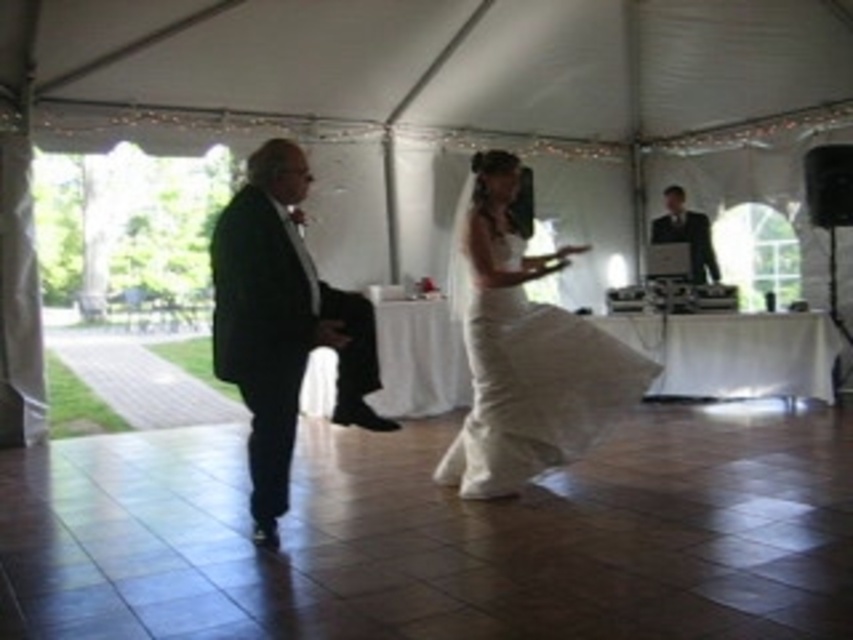
Where is `matte black suit at left`? matte black suit at left is located at coordinates (527, 356).

Can you confirm if matte black suit at left is thinner than matte black suit at upper right?

No.

Is point (288, 300) in front of point (694, 218)?

That is True.

Image resolution: width=853 pixels, height=640 pixels. Identify the location of matte black suit at left. (527, 356).

Is point (146, 74) farther from viewer compared to point (256, 285)?

Yes, point (146, 74) is farther from viewer.

Looking at this image, who is higher up, white fabric canopy at upper center or black satin suit at left?

white fabric canopy at upper center

Which is behind, point (637, 129) or point (227, 276)?

Point (637, 129)

Find the location of a particular element. The width and height of the screenshot is (853, 640). white fabric canopy at upper center is located at coordinates (440, 67).

Who is lower down, white satin dress at center or matte black suit at upper right?

white satin dress at center is lower down.

Can you confirm if white satin dress at center is thinner than matte black suit at upper right?

Incorrect, white satin dress at center's width is not less than matte black suit at upper right's.

Is point (477, 188) in front of point (694, 237)?

Yes.

Identify the location of white satin dress at center. The width and height of the screenshot is (853, 640). (526, 353).